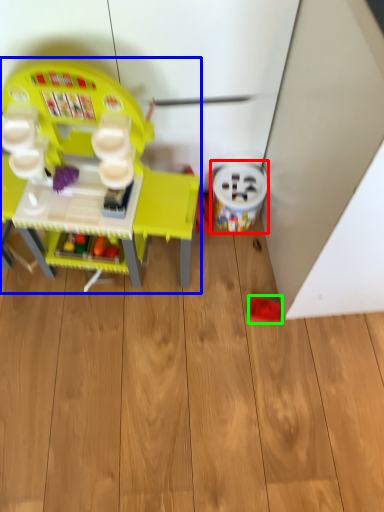
Question: Considering the real-world distances, which object is farthest from toy (highlighted by a red box)? toy (highlighted by a blue box) or toy (highlighted by a green box)?

Choices:
 (A) toy
 (B) toy

Answer: (A)